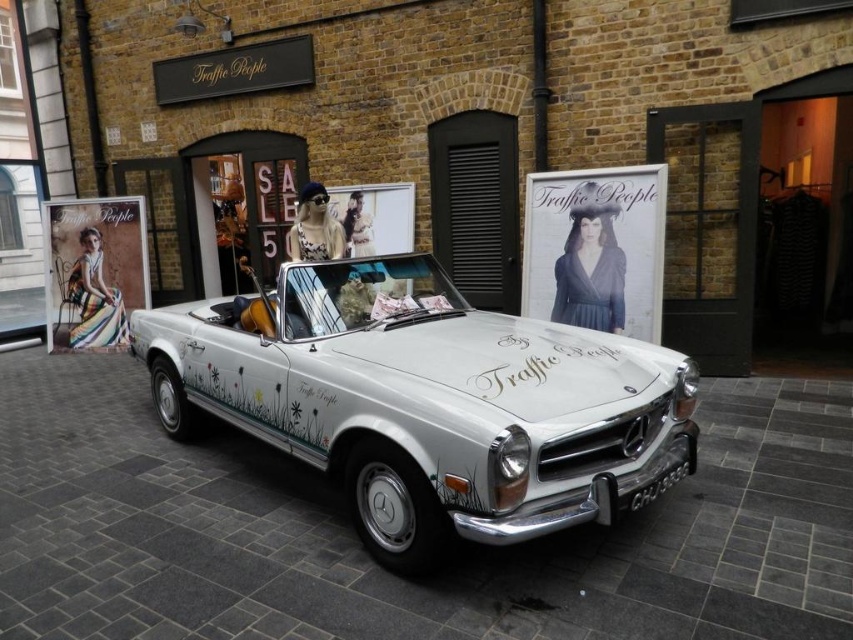
You are a photographer setting up a shoot in the showroom. You need to position a light source to highlight both the multicolored fabric dress at left and the black plastic license plate at center. Since the dress is above the license plate, where should you place the light to ensure both are well lit without casting harsh shadows?

Since the multicolored fabric dress at left is above the black plastic license plate at center, placing the light source above both objects will ensure even illumination and minimize harsh shadows. Position the light directly overhead or slightly forward to cover both the dress and the license plate effectively.

You are a photographer planning to take a closeup shot of the car. You want to ensure that both the multicolored fabric dress at left and the black plastic license plate at center are clearly visible in the frame. Given their sizes, which object should you focus on first to ensure proper focus?

The multicolored fabric dress at left is bigger than the black plastic license plate at center, so you should focus on the multicolored fabric dress at left first to ensure proper focus since larger objects require more precise focusing to capture all details clearly.